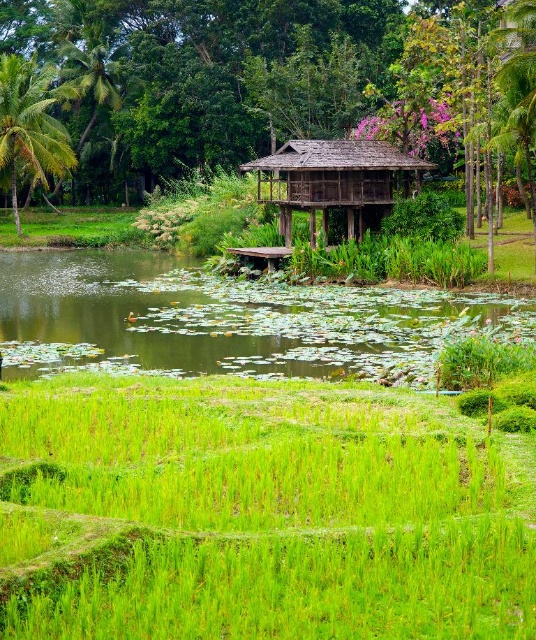
Question: Which point is farther to the camera?

Choices:
 (A) tap(274, 60)
 (B) tap(286, 413)
 (C) tap(456, 301)
 (D) tap(116, 99)

Answer: (D)

Question: Can you confirm if green leafy palm tree at left is positioned below green leafy palm tree at upper left?

Choices:
 (A) no
 (B) yes

Answer: (B)

Question: Which point appears closest to the camera in this image?

Choices:
 (A) (281, 76)
 (B) (1, 154)

Answer: (B)

Question: Does green grassy rice field at center appear on the right side of brown wooden hut at center?

Choices:
 (A) no
 (B) yes

Answer: (B)

Question: Based on their relative distances, which object is nearer to the green leafy palm tree at upper left?

Choices:
 (A) green lily pads at center
 (B) brown wooden hut at center
 (C) green grassy rice field at center

Answer: (B)

Question: Is green leafy palm tree at left above green leafy palm tree at upper left?

Choices:
 (A) no
 (B) yes

Answer: (A)